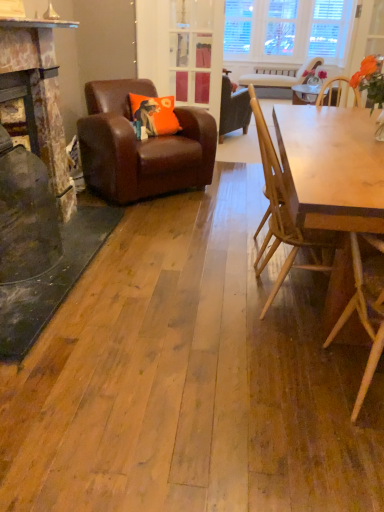
Question: Is clear glass door at center smaller than brown leather armchair at left, the fourth chair from the right?

Choices:
 (A) yes
 (B) no

Answer: (A)

Question: From a real-world perspective, is clear glass door at center under brown leather armchair at left, which is the 3th chair from front to back?

Choices:
 (A) yes
 (B) no

Answer: (B)

Question: From the image's perspective, does clear glass door at center appear lower than brown leather armchair at left, the 2th chair from the top?

Choices:
 (A) yes
 (B) no

Answer: (B)

Question: Is there a large distance between clear glass door at center and brown leather armchair at left, the 2th chair from the top?

Choices:
 (A) no
 (B) yes

Answer: (B)

Question: Can you confirm if clear glass door at center is taller than brown leather armchair at left, the 3th chair ordered from the bottom?

Choices:
 (A) yes
 (B) no

Answer: (A)

Question: In terms of height, does clear glass door at center look taller or shorter compared to light brown wooden chair at right, acting as the second chair starting from the right?

Choices:
 (A) short
 (B) tall

Answer: (B)

Question: Considering the positions of clear glass door at center and light brown wooden chair at right, arranged as the 3th chair when viewed from the left, in the image, is clear glass door at center wider or thinner than light brown wooden chair at right, arranged as the 3th chair when viewed from the left,?

Choices:
 (A) thin
 (B) wide

Answer: (A)

Question: Considering the relative positions of clear glass door at center and light brown wooden chair at right, which is the 1th chair in front-to-back order, in the image provided, is clear glass door at center to the left or to the right of light brown wooden chair at right, which is the 1th chair in front-to-back order,?

Choices:
 (A) right
 (B) left

Answer: (B)

Question: From a real-world perspective, is clear glass door at center above or below light brown wooden chair at right, positioned as the 1th chair in bottom-to-top order?

Choices:
 (A) above
 (B) below

Answer: (A)

Question: In terms of width, does light beige wood chair at upper center, which ranks as the 4th chair in left-to-right order, look wider or thinner when compared to light brown wooden chair at right, arranged as the 3th chair when viewed from the left?

Choices:
 (A) wide
 (B) thin

Answer: (A)

Question: In the image, is light beige wood chair at upper center, placed as the fourth chair when sorted from front to back, on the left side or the right side of light brown wooden chair at right, acting as the second chair starting from the right?

Choices:
 (A) right
 (B) left

Answer: (A)

Question: Is light beige wood chair at upper center, placed as the fourth chair when sorted from front to back, bigger or smaller than light brown wooden chair at right, positioned as the 1th chair in bottom-to-top order?

Choices:
 (A) small
 (B) big

Answer: (B)

Question: From the image's perspective, is light beige wood chair at upper center, the first chair from the right, located above or below light brown wooden chair at right, the 4th chair when ordered from top to bottom?

Choices:
 (A) below
 (B) above

Answer: (B)

Question: Considering the positions of light brown wooden table at right and clear glass door at center in the image, is light brown wooden table at right wider or thinner than clear glass door at center?

Choices:
 (A) thin
 (B) wide

Answer: (B)

Question: In terms of height, does light brown wooden table at right look taller or shorter compared to clear glass door at center?

Choices:
 (A) short
 (B) tall

Answer: (A)